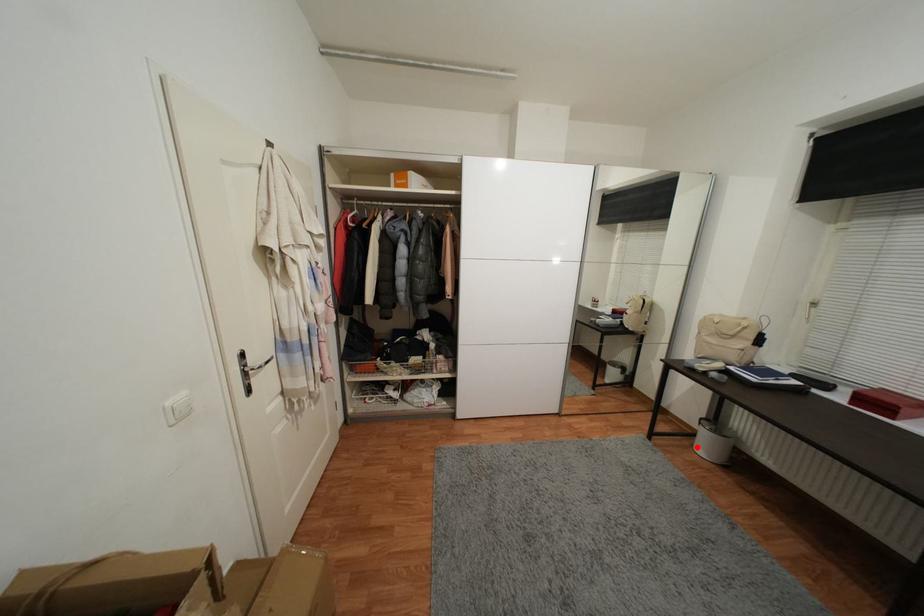
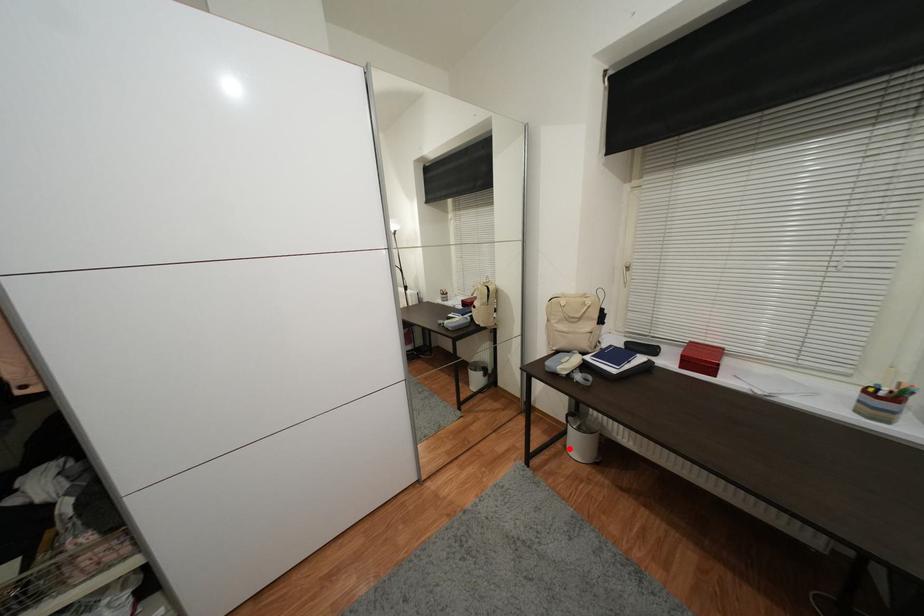
I am providing you with two images of the same scene from different viewpoints. A red point is marked on the first image and another point is marked on the second image. Is the red point in image1 aligned with the point shown in image2?

Yes